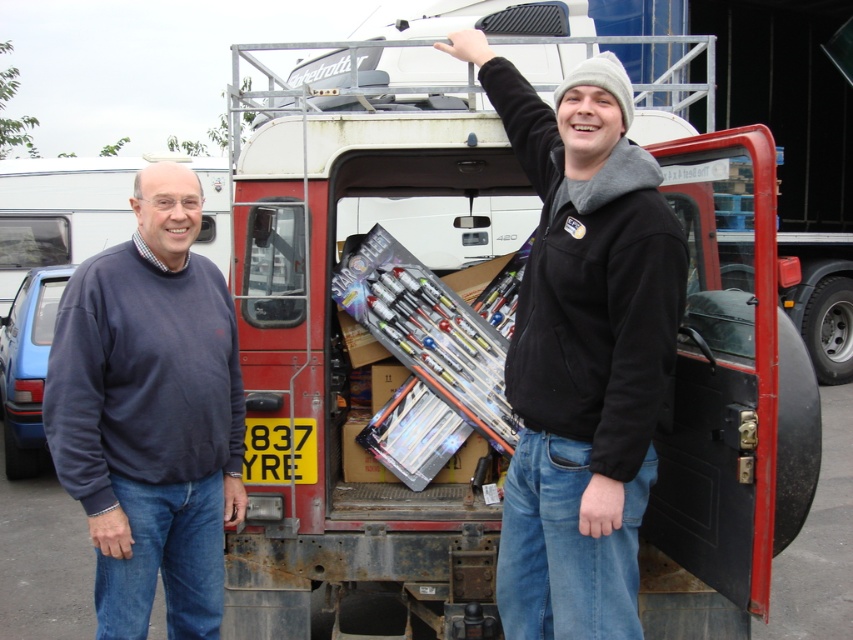
Question: Which of the following is the closest to the observer?

Choices:
 (A) (665, 323)
 (B) (97, 429)
 (C) (270, 330)

Answer: (A)

Question: Observing the image, what is the correct spatial positioning of metallic trailer truck at center in reference to dark blue sweater at left?

Choices:
 (A) right
 (B) left

Answer: (A)

Question: Which object is the farthest from the metallic trailer truck at center?

Choices:
 (A) metallic silver toolbox at upper center
 (B) dark blue sweater at left

Answer: (A)

Question: Does metallic trailer truck at center have a larger size compared to metallic silver toolbox at upper center?

Choices:
 (A) yes
 (B) no

Answer: (A)

Question: Considering the relative positions of metallic silver toolbox at upper center and dark blue sweater at left in the image provided, where is metallic silver toolbox at upper center located with respect to dark blue sweater at left?

Choices:
 (A) below
 (B) above

Answer: (B)

Question: Which of the following is the farthest from the observer?

Choices:
 (A) (769, 268)
 (B) (595, 452)

Answer: (A)